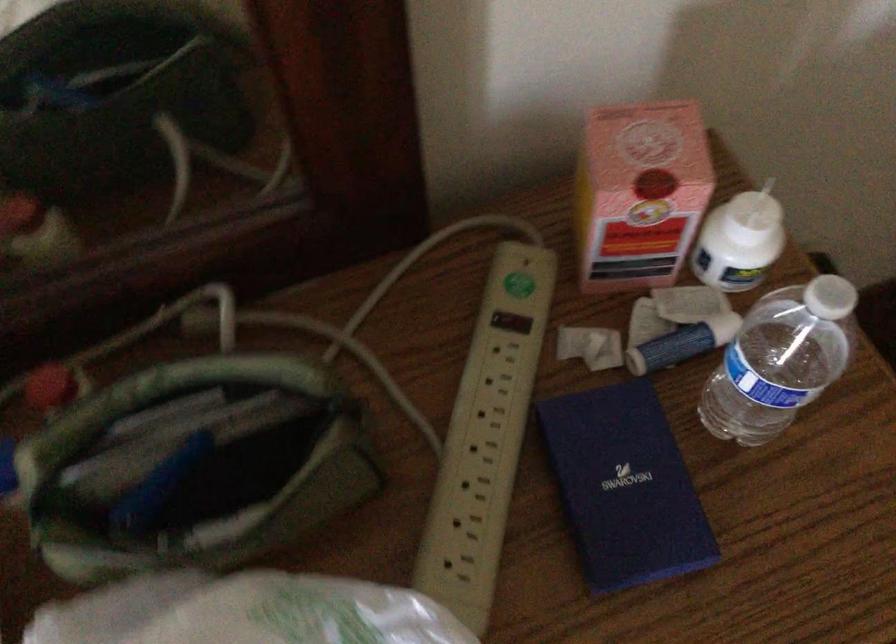
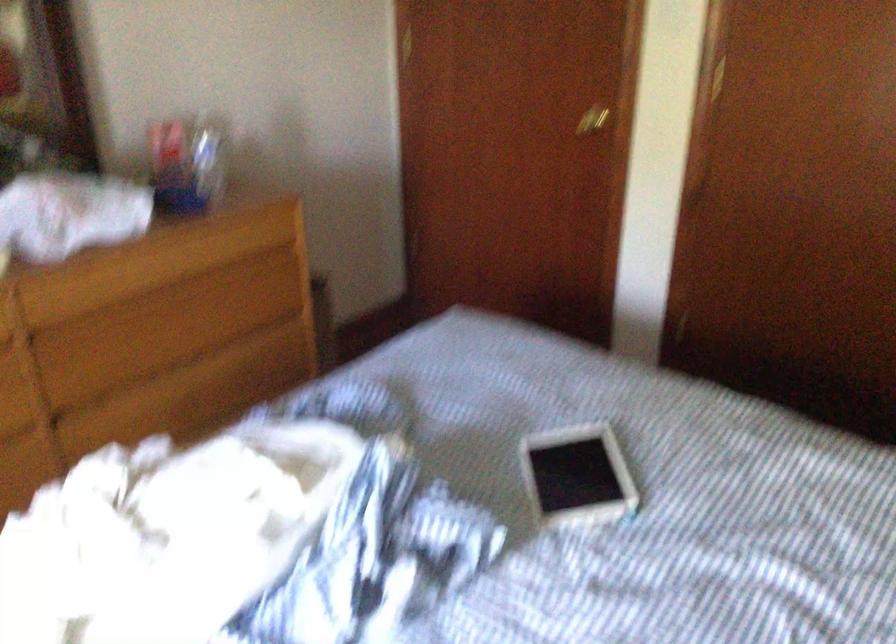
Where in the second image is the point corresponding to (786,389) from the first image?

(208, 156)